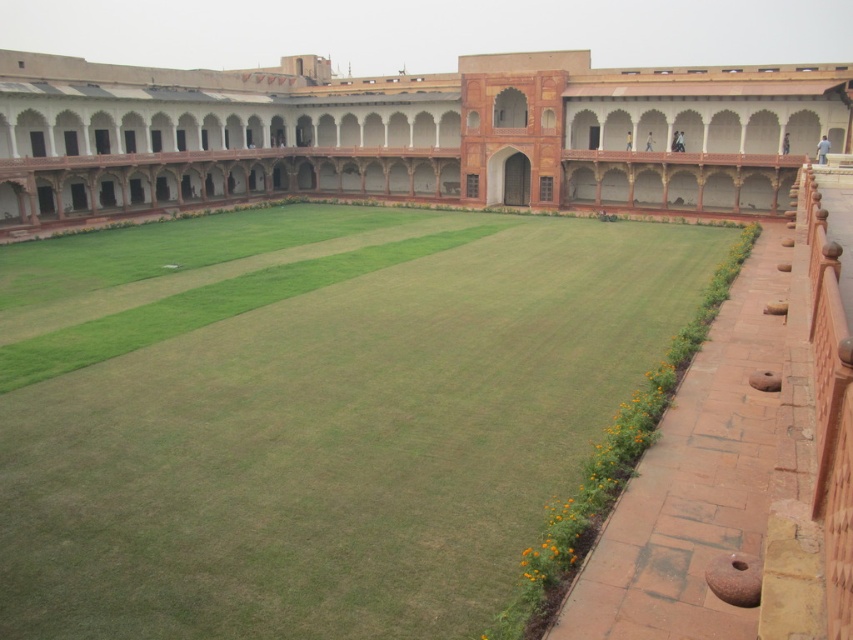
Looking at this image, you are standing in the courtyard and want to walk towards the terracotta stone palace at center. Which direction should you move relative to the green grass at center?

You should move behind the green grass at center to reach the terracotta stone palace at center since the green grass at center is in front of it.

You are standing in the courtyard and want to walk towards the green grass at center. Which direction should you walk to reach it?

The green grass at center is located at point 0.647 on the x axis and 0.368 on the y axis. Since you are in the courtyard, you should walk towards the center of the courtyard to reach the green grass at center.